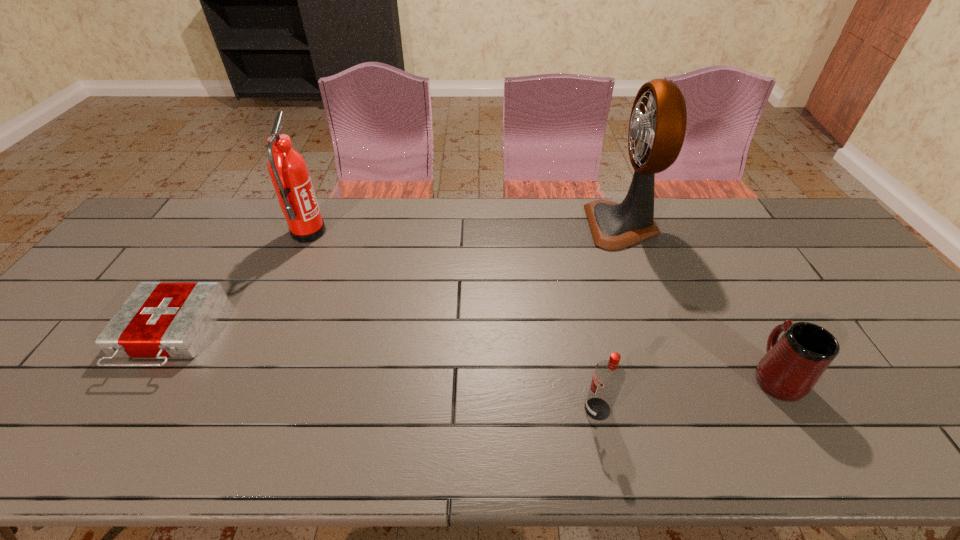
Identify the location of free point located 0.370m on the front-facing side of the second object from right to left. (476, 226).

Locate an element on the screen. The image size is (960, 540). vacant region located on the front-facing side of the second object from right to left is located at coordinates (546, 226).

You are a GUI agent. You are given a task and a screenshot of the screen. Output one action in this format:
    pyautogui.click(x=<x>, y=<y>)
    Task: Click on the vacant space located 0.070m on the front-facing side of the second object from right to left
    This screenshot has height=540, width=960.
    Given the screenshot: What is the action you would take?
    pyautogui.click(x=567, y=226)

Locate an element on the screen. The image size is (960, 540). free space located 0.110m on the label side of the fourth shortest object is located at coordinates (359, 233).

Image resolution: width=960 pixels, height=540 pixels. What are the coordinates of `vacant space located on the front label of the third object from left to right` in the screenshot? It's located at (429, 409).

Where is `free spot located on the front label of the third object from left to right`? This screenshot has width=960, height=540. free spot located on the front label of the third object from left to right is located at coordinates (524, 409).

Where is `free space located on the front label of the third object from left to right`? The image size is (960, 540). free space located on the front label of the third object from left to right is located at coordinates (420, 409).

Locate an element on the screen. The image size is (960, 540). blank area located 0.240m on the side of the rightmost object with the handle is located at coordinates (722, 281).

Locate an element on the screen. This screenshot has width=960, height=540. vacant space situated 0.110m on the side of the rightmost object with the handle is located at coordinates click(x=741, y=316).

Locate an element on the screen. The width and height of the screenshot is (960, 540). vacant space situated on the side of the rightmost object with the handle is located at coordinates (724, 284).